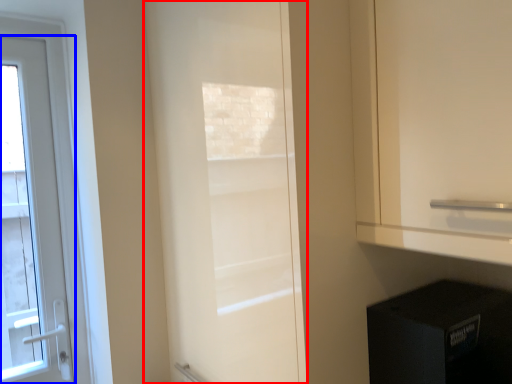
Question: Which of the following is the closest to the observer, door (highlighted by a red box) or door (highlighted by a blue box)?

Choices:
 (A) door
 (B) door

Answer: (A)